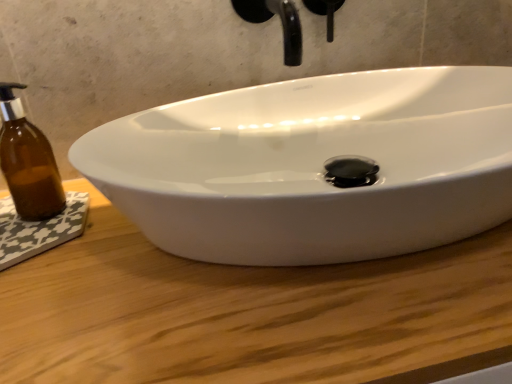
Where is `free space on the front side of brown glass bottle at left`? This screenshot has height=384, width=512. free space on the front side of brown glass bottle at left is located at coordinates (69, 297).